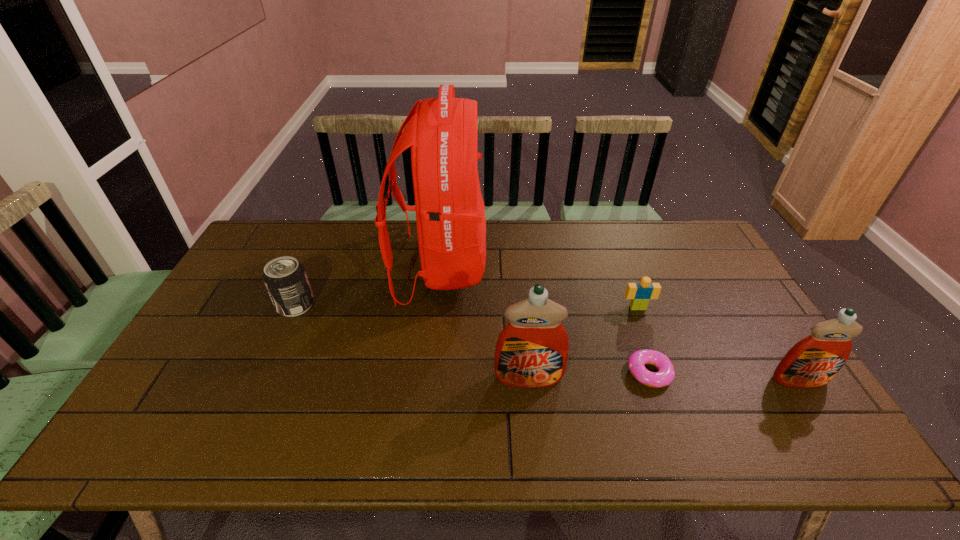
Please show where to add a detergent on the left while keeping spacing even. Please provide its 2D coordinates. Your answer should be formatted as a tuple, i.e. [(x, y)], where the tuple contains the x and y coordinates of a point satisfying the conditions above.

[(261, 376)]